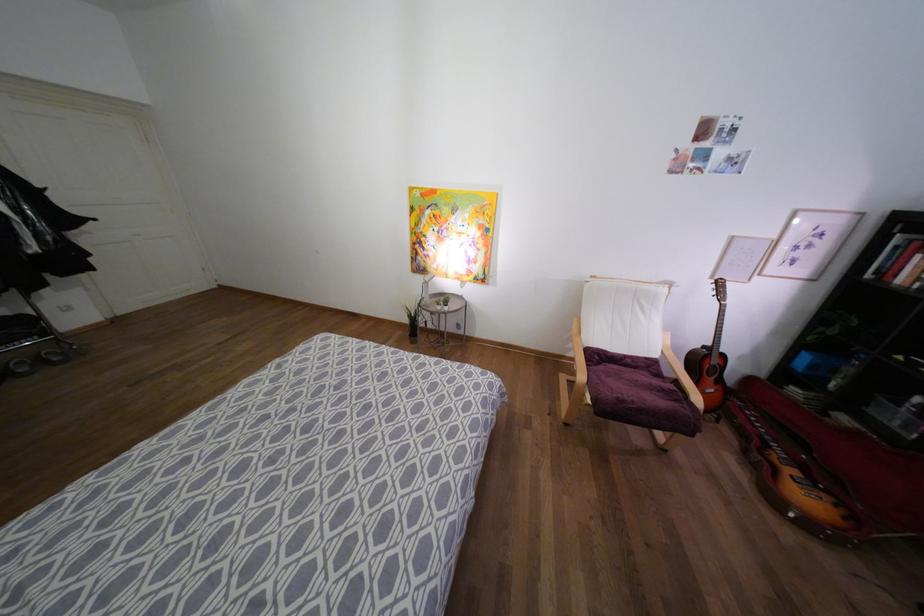
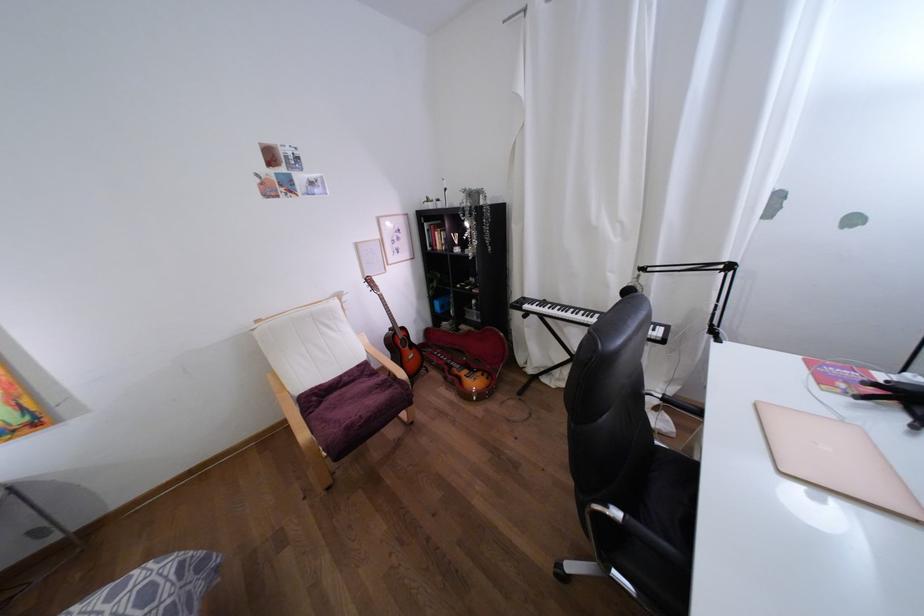
Find the pixel in the second image that matches point 721,350 in the first image.

(398, 325)